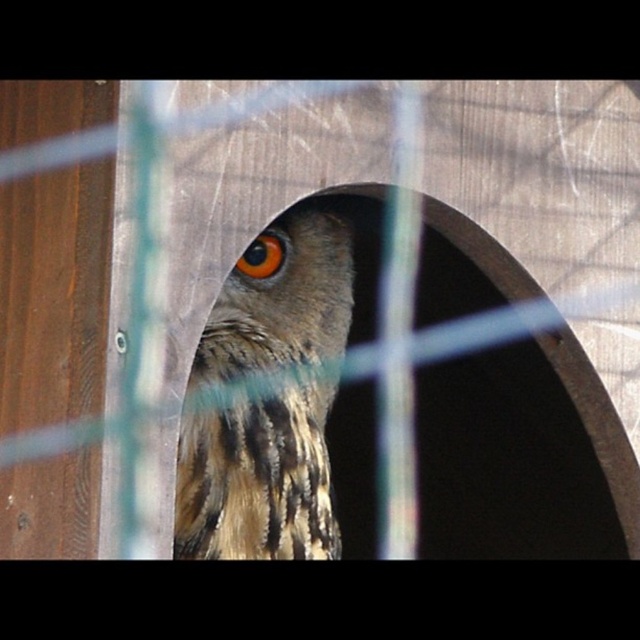
Question: Among these points, which one is farthest from the camera?

Choices:
 (A) (269, 444)
 (B) (282, 250)

Answer: (B)

Question: Is brown speckled feathers at center below brown textured eye at center?

Choices:
 (A) no
 (B) yes

Answer: (B)

Question: Which point is closer to the camera taking this photo?

Choices:
 (A) (278, 268)
 (B) (230, 433)

Answer: (B)

Question: Which point appears closest to the camera in this image?

Choices:
 (A) (275, 241)
 (B) (237, 349)

Answer: (B)

Question: Is brown speckled feathers at center closer to the viewer compared to brown textured eye at center?

Choices:
 (A) no
 (B) yes

Answer: (B)

Question: Can you confirm if brown speckled feathers at center is positioned to the right of brown textured eye at center?

Choices:
 (A) yes
 (B) no

Answer: (A)